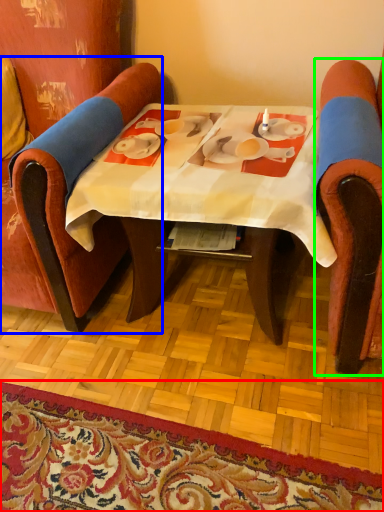
Question: Which is farther away from mat (highlighted by a red box)? chair (highlighted by a blue box) or chair (highlighted by a green box)?

Choices:
 (A) chair
 (B) chair

Answer: (B)